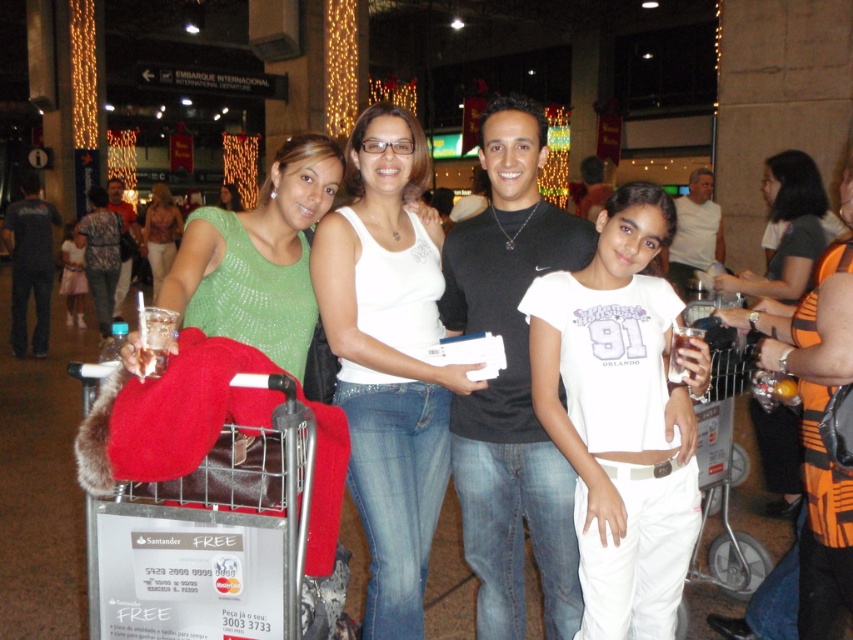
Question: Does white cotton shirt at center have a smaller size compared to white denim jeans at center?

Choices:
 (A) no
 (B) yes

Answer: (B)

Question: Which object is closer to the camera taking this photo?

Choices:
 (A) white denim jeans at center
 (B) orange striped tank top at center
 (C) green knit sweater at center

Answer: (A)

Question: Is the position of white cotton shirt at center less distant than that of green knit sweater at center?

Choices:
 (A) no
 (B) yes

Answer: (B)

Question: Can you confirm if orange striped tank top at center is positioned above green knit sweater at center?

Choices:
 (A) yes
 (B) no

Answer: (B)

Question: Which object is positioned closest to the white denim jeans at center?

Choices:
 (A) green knit sweater at center
 (B) white cotton shirt at center

Answer: (B)

Question: Which point is closer to the camera?

Choices:
 (A) (775, 294)
 (B) (698, 369)
 (C) (302, 480)
 (D) (163, 220)

Answer: (C)